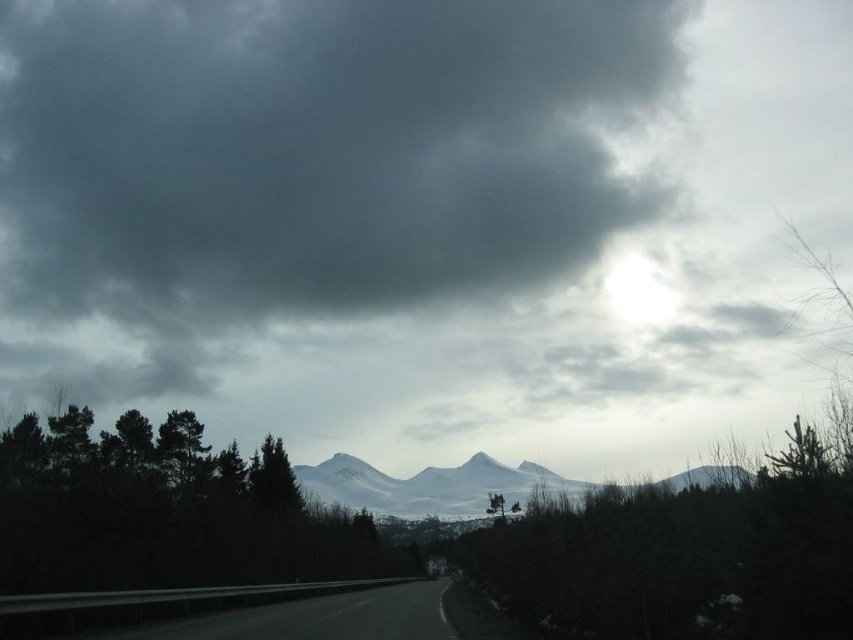
Question: Among these objects, which one is nearest to the camera?

Choices:
 (A) black asphalt highway at lower center
 (B) dark gray cloud at upper center

Answer: (A)

Question: Can you confirm if dark gray cloud at upper center is smaller than black asphalt highway at lower center?

Choices:
 (A) no
 (B) yes

Answer: (A)

Question: Can you confirm if dark gray cloud at upper center is positioned to the left of black asphalt highway at lower center?

Choices:
 (A) yes
 (B) no

Answer: (A)

Question: Which point is farther to the camera?

Choices:
 (A) dark gray cloud at upper center
 (B) black asphalt highway at lower center

Answer: (A)

Question: Observing the image, what is the correct spatial positioning of dark gray cloud at upper center in reference to black asphalt highway at lower center?

Choices:
 (A) left
 (B) right

Answer: (A)